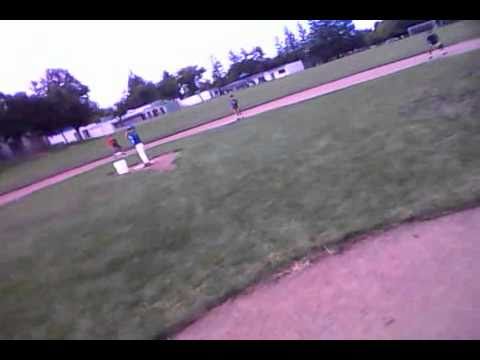
The height and width of the screenshot is (360, 480). I want to click on top left corner empty space, so click(x=4, y=2).